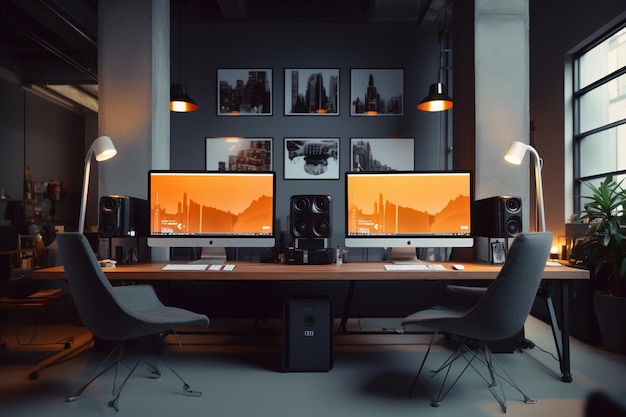
The width and height of the screenshot is (626, 417). What are the coordinates of `floor` in the screenshot? It's located at (334, 394).